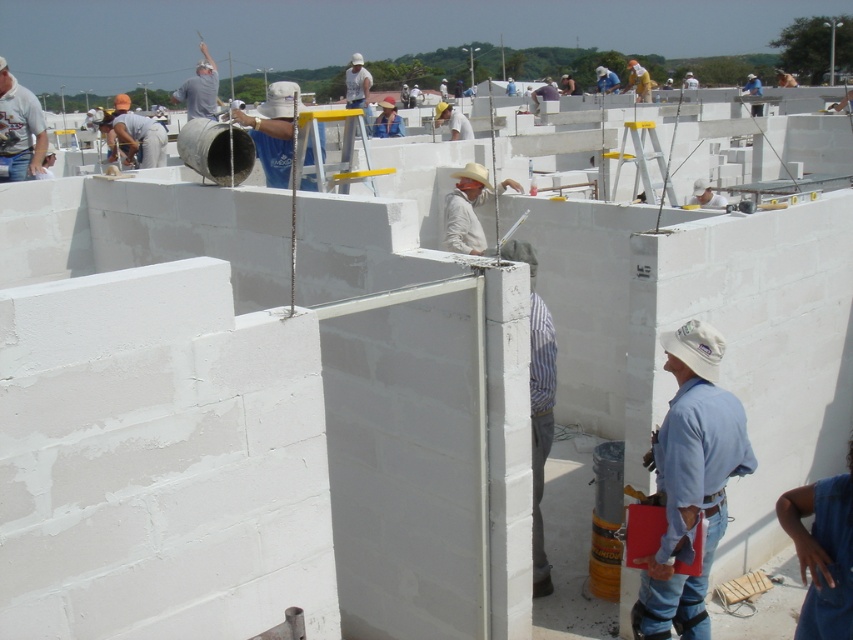
Between matte white concrete block at upper left and white matte hard hat at upper center, which one has less height?

white matte hard hat at upper center

Does matte white concrete block at upper left have a greater height compared to white matte hard hat at upper center?

Yes.

Where is `matte white concrete block at upper left`? The height and width of the screenshot is (640, 853). matte white concrete block at upper left is located at coordinates (138, 134).

Who is higher up, white striped shirt at center or white matte concrete worker at center?

white matte concrete worker at center

Does point (534, 573) come closer to viewer compared to point (474, 184)?

Yes.

Between point (534, 264) and point (451, 216), which one is positioned behind?

Point (451, 216)

I want to click on white striped shirt at center, so click(x=537, y=403).

Is white cotton shirt at upper left positioned in front of white matte bucket at center?

That is False.

Which is above, white cotton shirt at upper left or white matte bucket at center?

Positioned higher is white matte bucket at center.

Image resolution: width=853 pixels, height=640 pixels. In order to click on white cotton shirt at upper left in this screenshot , I will do `click(19, 129)`.

The width and height of the screenshot is (853, 640). Identify the location of white cotton shirt at upper left. (19, 129).